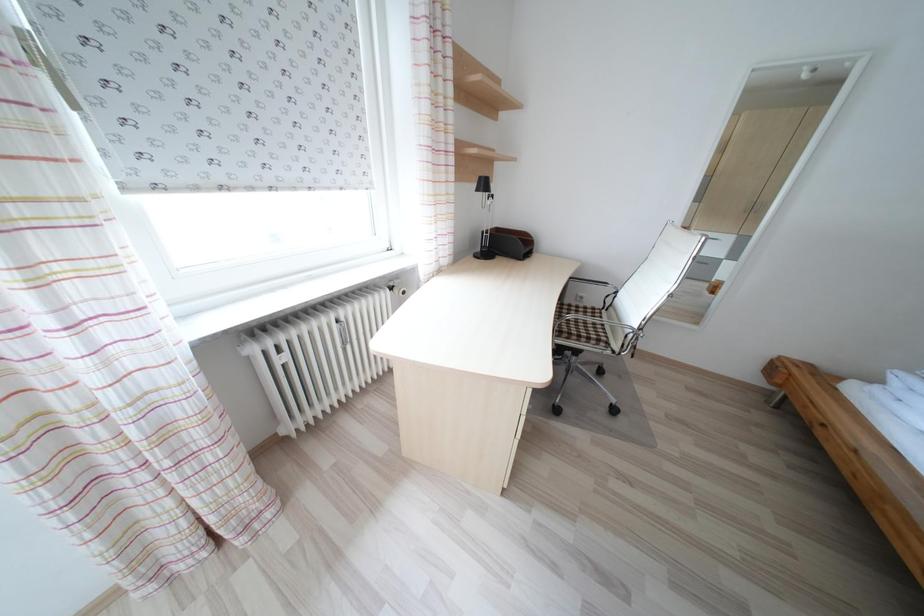
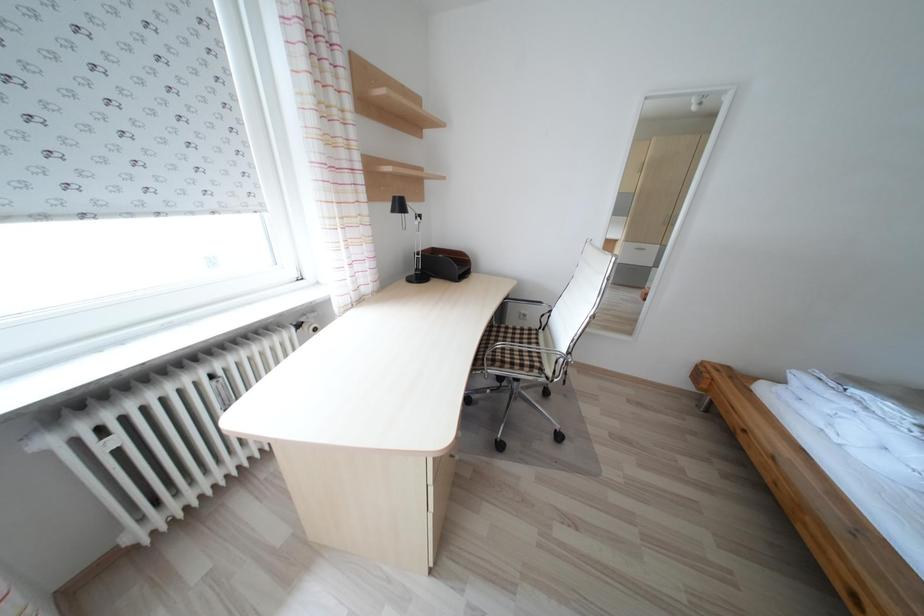
What movement of the cameraman would produce the second image?

The movement direction of the cameraman is right, forward.